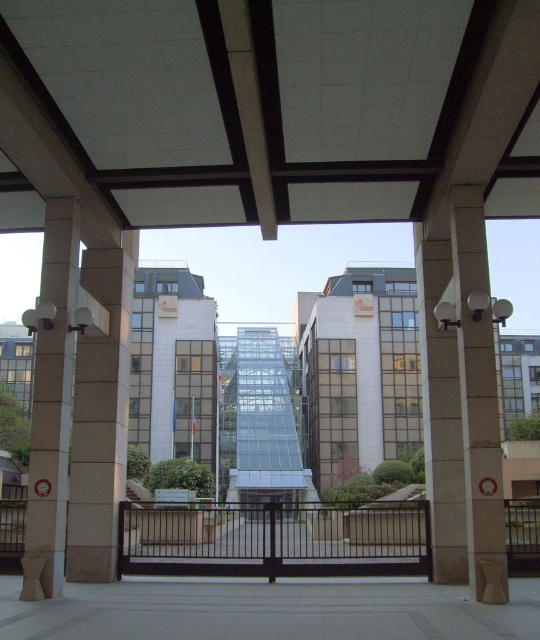
You are standing at the entrance of the walkway and want to take a photo of both the brown stone column at left and the slate gray concrete pillar at right. Since you can only stand in one spot, which pillar should you position yourself closer to in order to capture both in the frame?

You should position yourself closer to the brown stone column at left because it is farther away from the slate gray concrete pillar at right, allowing you to include both in the frame by being near the leftmost object.

You are standing at the entrance of the covered walkway and see two points marked in the image. The first point is located at coordinates point (469,241) and the second point is at point (426,376). Which of these two points is nearer to your current position?

Point (469,241) is closer to the camera than point (426,376), so the first point is nearer to your current position.

You are a painter standing at the entrance of the walkway. You need to paint both the brown stone column at left and the slate gray concrete pillar at right. Which column should you paint first if you want to start with the shorter one?

The brown stone column at left is not as tall as the slate gray concrete pillar at right, so you should paint the brown stone column at left first since it is shorter.